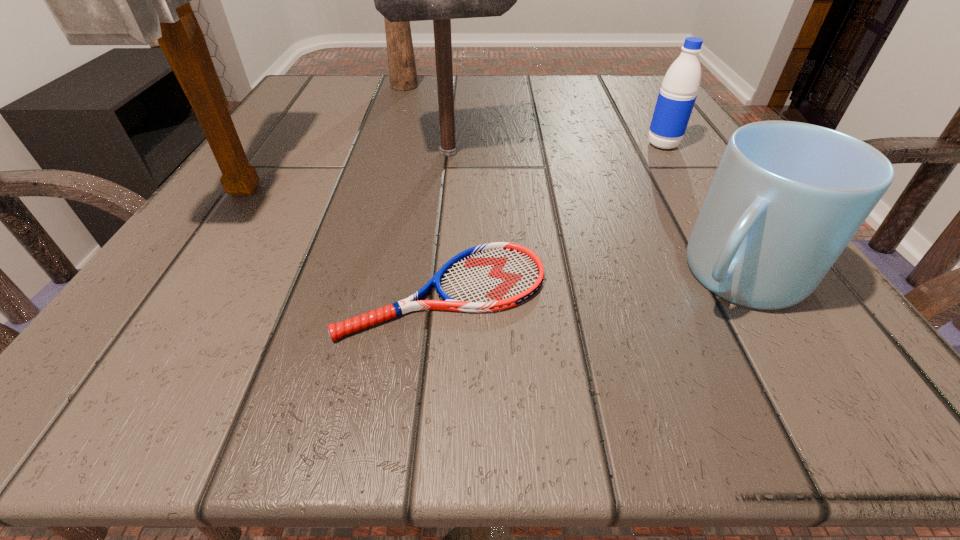
This screenshot has width=960, height=540. I want to click on free area in between the farthest mallet and the tennis racket, so click(x=423, y=189).

Where is `blank region between the mug and the shortest object`? blank region between the mug and the shortest object is located at coordinates (590, 283).

This screenshot has height=540, width=960. I want to click on free point between the tennis racket and the mug, so click(x=590, y=283).

The height and width of the screenshot is (540, 960). I want to click on free space between the leftmost object and the farthest mallet, so click(325, 137).

This screenshot has height=540, width=960. I want to click on vacant area between the mug and the water bottle, so click(700, 210).

I want to click on free point between the mug and the leftmost object, so click(492, 231).

You are a GUI agent. You are given a task and a screenshot of the screen. Output one action in this format:
    pyautogui.click(x=<x>, y=<y>)
    Task: Click on the vacant space that is in between the water bottle and the leftmost mallet
    The height and width of the screenshot is (540, 960).
    Given the screenshot: What is the action you would take?
    pyautogui.click(x=455, y=166)

Find the location of a particular element. The width and height of the screenshot is (960, 540). free space that is in between the shortest object and the water bottle is located at coordinates (553, 218).

Locate an element on the screen. This screenshot has width=960, height=540. free space that is in between the water bottle and the mug is located at coordinates (700, 210).

Where is `the closest object to the mug`? The height and width of the screenshot is (540, 960). the closest object to the mug is located at coordinates (x=494, y=276).